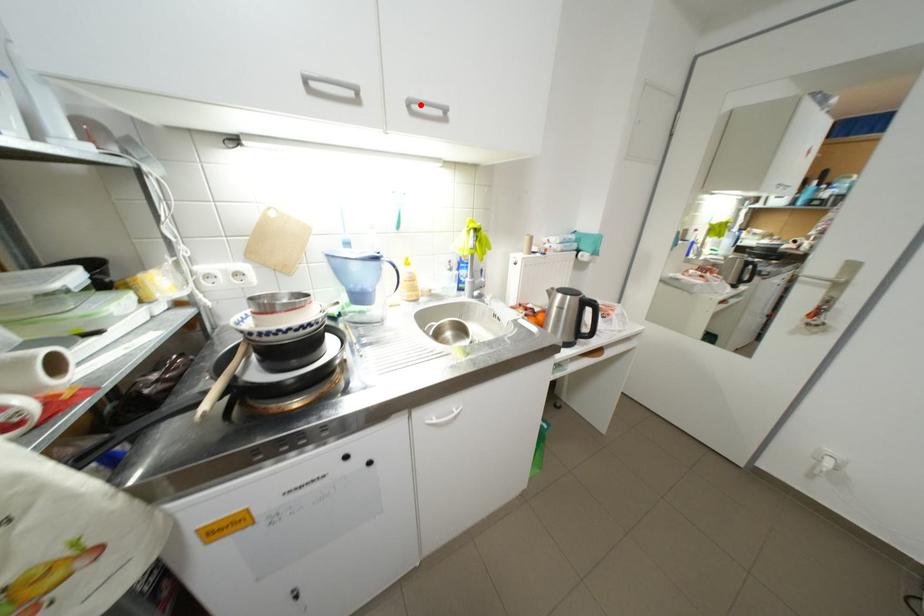
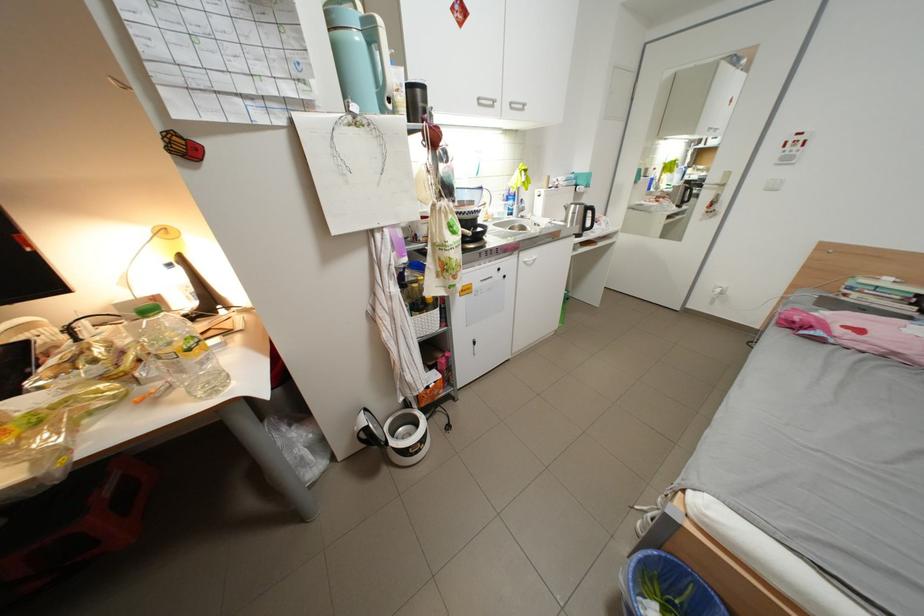
In the second image, find the point that corresponds to the highlighted location in the first image.

(523, 105)